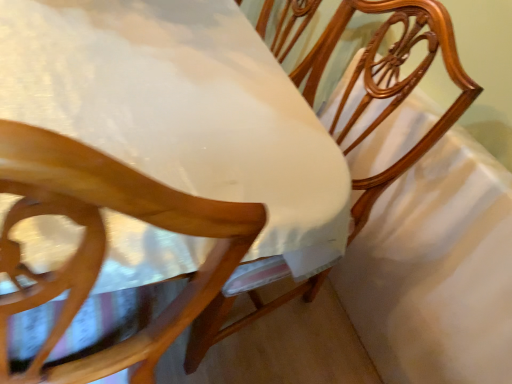
Question: In terms of size, does wooden chair at center appear bigger or smaller than white glossy table at center?

Choices:
 (A) big
 (B) small

Answer: (B)

Question: Considering the positions of wooden chair at center and white glossy table at center in the image, is wooden chair at center wider or thinner than white glossy table at center?

Choices:
 (A) thin
 (B) wide

Answer: (A)

Question: Considering the real-world distances, which object is farthest from the wooden chair at center?

Choices:
 (A) white satin sheet at center
 (B) white glossy table at center

Answer: (B)

Question: Estimate the real-world distances between objects in this image. Which object is closer to the white satin sheet at center?

Choices:
 (A) wooden chair at center
 (B) white glossy table at center

Answer: (A)